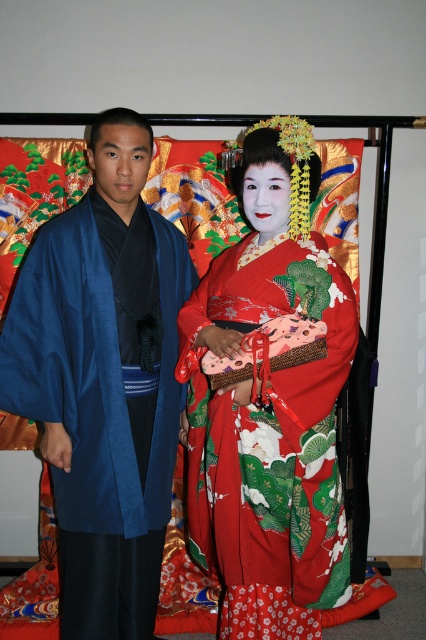
Which of these two, blue silk kimono at left or silky red kimono at center, stands shorter?

silky red kimono at center is shorter.

Locate an element on the screen. The image size is (426, 640). blue silk kimono at left is located at coordinates point(103,380).

Locate an element on the screen. The width and height of the screenshot is (426, 640). blue silk kimono at left is located at coordinates (103, 380).

The image size is (426, 640). Identify the location of blue silk kimono at left. (103, 380).